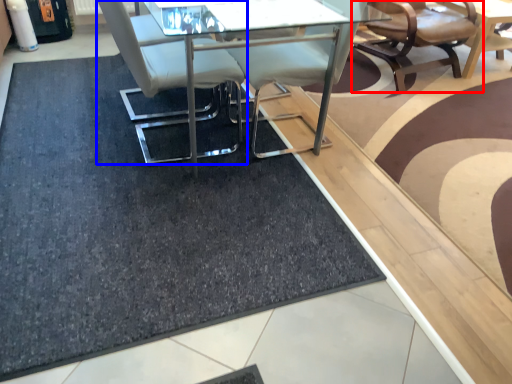
Question: Which point is further to the camera, chair (highlighted by a red box) or chair (highlighted by a blue box)?

Choices:
 (A) chair
 (B) chair

Answer: (A)